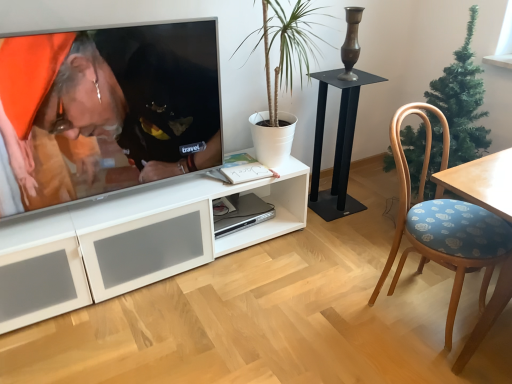
Question: From the image's perspective, is black metal table at center on wooden chair with blue floral cushion at right?

Choices:
 (A) yes
 (B) no

Answer: (A)

Question: Considering the relative sizes of black metal table at center and wooden chair with blue floral cushion at right in the image provided, is black metal table at center bigger than wooden chair with blue floral cushion at right?

Choices:
 (A) yes
 (B) no

Answer: (B)

Question: From a real-world perspective, is black metal table at center over wooden chair with blue floral cushion at right?

Choices:
 (A) no
 (B) yes

Answer: (A)

Question: Does black metal table at center turn towards wooden chair with blue floral cushion at right?

Choices:
 (A) no
 (B) yes

Answer: (B)

Question: Does black metal table at center have a lesser width compared to wooden chair with blue floral cushion at right?

Choices:
 (A) yes
 (B) no

Answer: (A)

Question: From the image's perspective, is green artificial christmas tree at right above or below sleek silver computer at center?

Choices:
 (A) above
 (B) below

Answer: (A)

Question: Based on their sizes in the image, would you say green artificial christmas tree at right is bigger or smaller than sleek silver computer at center?

Choices:
 (A) big
 (B) small

Answer: (A)

Question: In the image, is green artificial christmas tree at right positioned in front of or behind sleek silver computer at center?

Choices:
 (A) behind
 (B) front

Answer: (B)

Question: Is point (452, 122) positioned closer to the camera than point (234, 208)?

Choices:
 (A) farther
 (B) closer

Answer: (B)

Question: From a real-world perspective, is black metal table at center positioned above or below green artificial christmas tree at right?

Choices:
 (A) above
 (B) below

Answer: (B)

Question: In terms of height, does black metal table at center look taller or shorter compared to green artificial christmas tree at right?

Choices:
 (A) short
 (B) tall

Answer: (A)

Question: Based on their sizes in the image, would you say black metal table at center is bigger or smaller than green artificial christmas tree at right?

Choices:
 (A) big
 (B) small

Answer: (B)

Question: Is point (347, 152) closer or farther from the camera than point (465, 43)?

Choices:
 (A) farther
 (B) closer

Answer: (A)

Question: Based on their positions, is matte black shirt at upper left located to the left or right of white matte plant at center?

Choices:
 (A) left
 (B) right

Answer: (A)

Question: Is matte black shirt at upper left situated inside white matte plant at center or outside?

Choices:
 (A) outside
 (B) inside

Answer: (A)